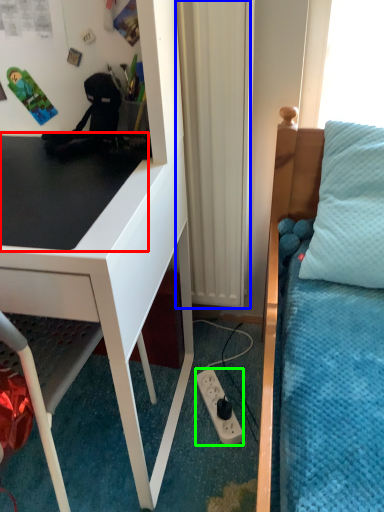
Question: Estimate the real-world distances between objects in this image. Which object is farther from table top (highlighted by a red box), curtain (highlighted by a blue box) or power outlet (highlighted by a green box)?

Choices:
 (A) curtain
 (B) power outlet

Answer: (B)